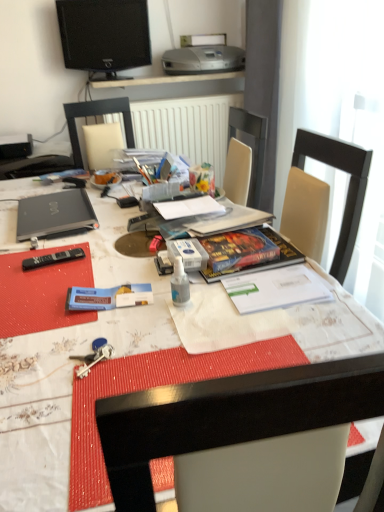
Find the location of `vacant point above white glossy desk at center (from a real-world perspective)`. vacant point above white glossy desk at center (from a real-world perspective) is located at coordinates (100, 281).